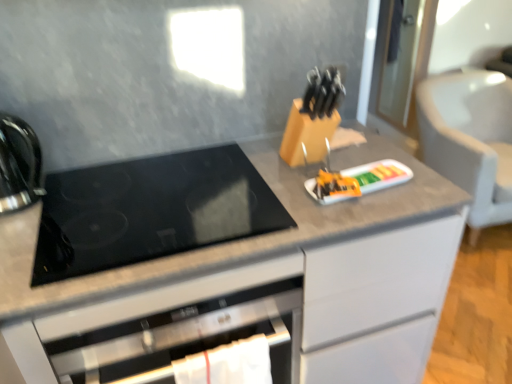
Image resolution: width=512 pixels, height=384 pixels. I want to click on blank space situated above wooden cabinet at center (from a real-world perspective), so click(364, 182).